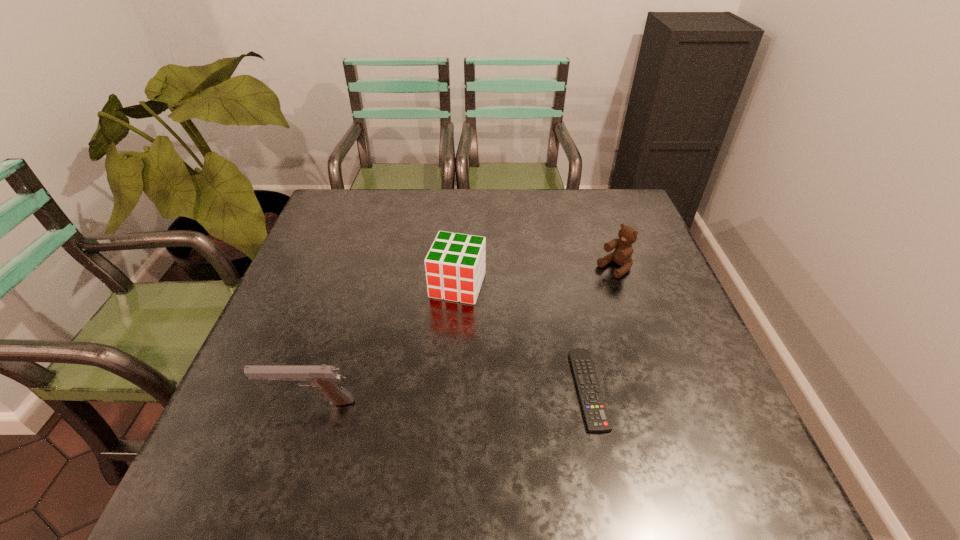
Image resolution: width=960 pixels, height=540 pixels. What are the coordinates of `pistol` in the screenshot? It's located at (325, 378).

Find the location of a particular element. the shortest object is located at coordinates (595, 413).

Locate an element on the screen. Image resolution: width=960 pixels, height=540 pixels. the third object from left to right is located at coordinates (595, 413).

Locate an element on the screen. the third object from right to left is located at coordinates (455, 266).

You are a GUI agent. You are given a task and a screenshot of the screen. Output one action in this format:
    pyautogui.click(x=<x>, y=<y>)
    Task: Click on the teddy bear
    
    Given the screenshot: What is the action you would take?
    pyautogui.click(x=622, y=255)

The height and width of the screenshot is (540, 960). I want to click on vacant area situated 0.280m on the left of the shortest object, so click(439, 389).

The height and width of the screenshot is (540, 960). Identify the location of vacant space located 0.370m on the red face of the third object from right to left. (397, 443).

Where is `free region located on the red face of the third object from right to left`? The image size is (960, 540). free region located on the red face of the third object from right to left is located at coordinates (431, 355).

Locate an element on the screen. The width and height of the screenshot is (960, 540). vacant space situated 0.350m on the red face of the third object from right to left is located at coordinates (401, 433).

In order to click on free space located on the face of the rightmost object in this screenshot , I will do `click(562, 303)`.